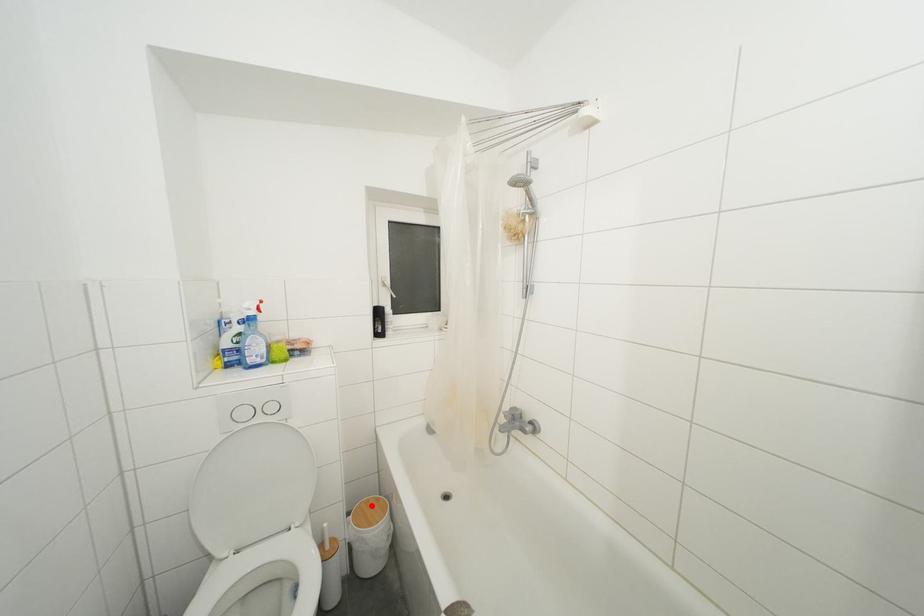
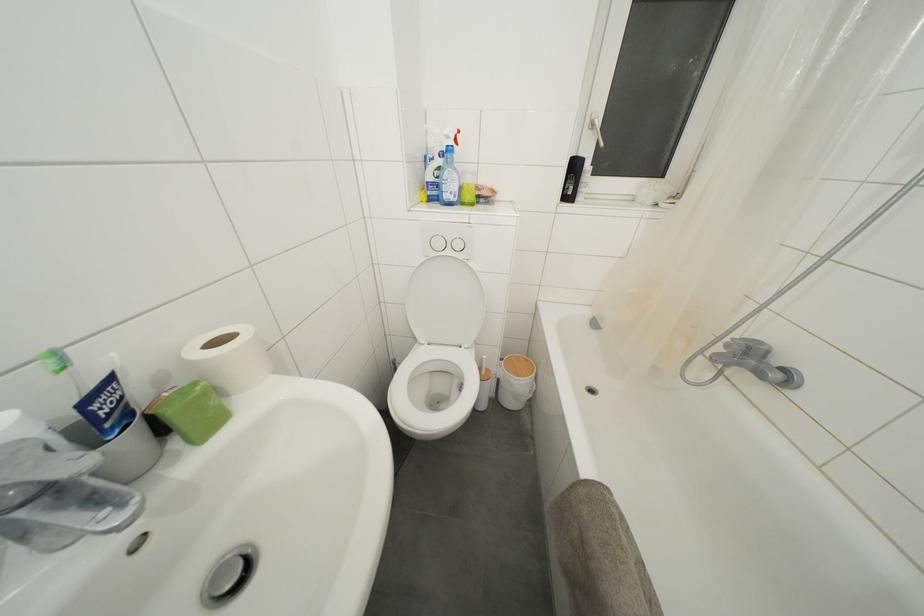
Question: A red point is marked in image1. In image2, is the corresponding 3D point closer to the camera or farther? Reply with the corresponding letter.

Choices:
 (A) The corresponding 3D point is closer.
 (B) The corresponding 3D point is farther.

Answer: (B)